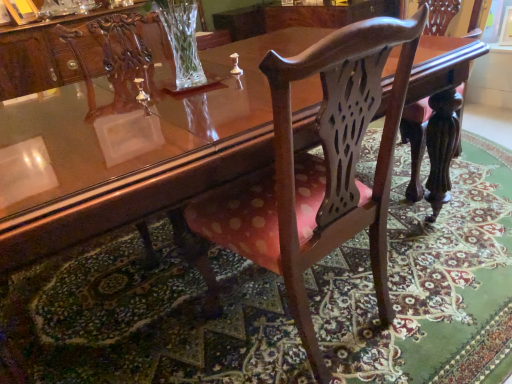
Question: Relative to polka dot fabric chair at center, is pink fabric chair at center in front or behind?

Choices:
 (A) behind
 (B) front

Answer: (A)

Question: Based on their sizes in the image, would you say pink fabric chair at center is bigger or smaller than polka dot fabric chair at center?

Choices:
 (A) big
 (B) small

Answer: (B)

Question: From the image's perspective, is pink fabric chair at center located above or below polka dot fabric chair at center?

Choices:
 (A) above
 (B) below

Answer: (B)

Question: From the image's perspective, is polka dot fabric chair at center above or below pink fabric chair at center?

Choices:
 (A) below
 (B) above

Answer: (B)

Question: From a real-world perspective, relative to pink fabric chair at center, is polka dot fabric chair at center vertically above or below?

Choices:
 (A) below
 (B) above

Answer: (B)

Question: Considering the positions of polka dot fabric chair at center and pink fabric chair at center in the image, is polka dot fabric chair at center wider or thinner than pink fabric chair at center?

Choices:
 (A) thin
 (B) wide

Answer: (A)

Question: In terms of size, does polka dot fabric chair at center appear bigger or smaller than pink fabric chair at center?

Choices:
 (A) big
 (B) small

Answer: (A)